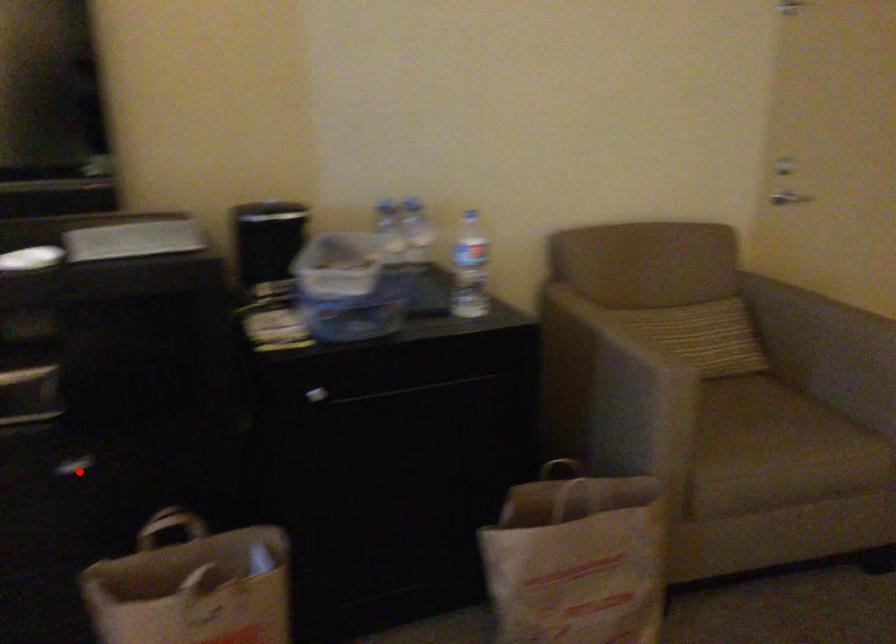
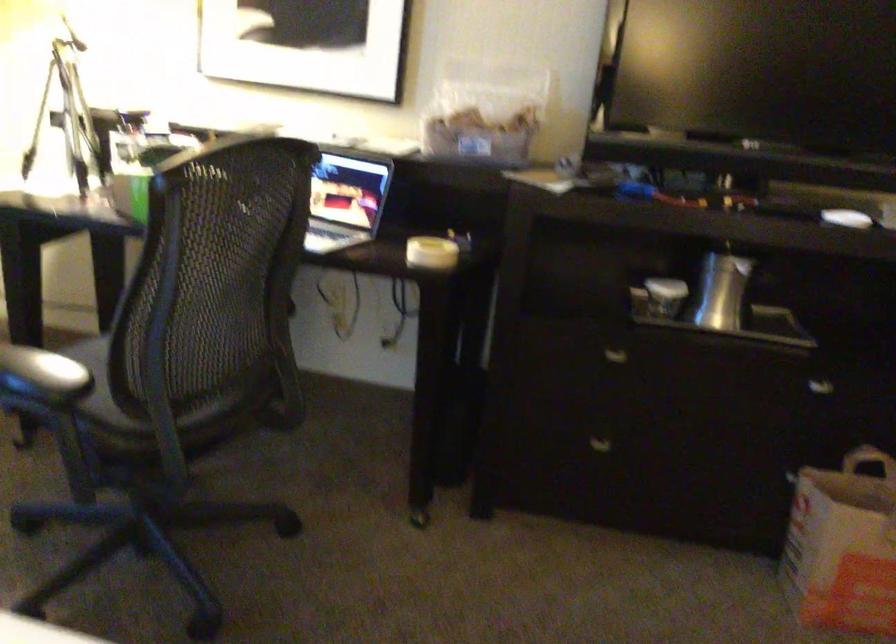
Where in the second image is the point corresponding to the highlighted location from the first image?

(821, 389)